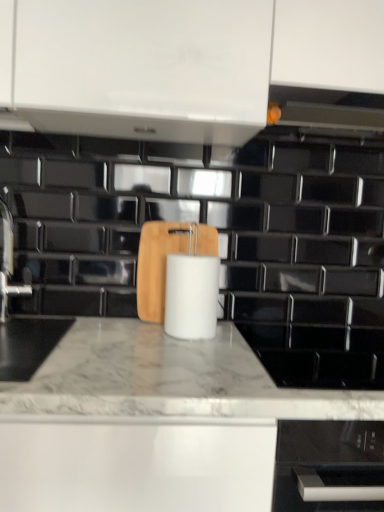
Question: From the image's perspective, is white matte paper towel at center located beneath satin nickel faucet at left?

Choices:
 (A) no
 (B) yes

Answer: (B)

Question: Is white matte paper towel at center far from satin nickel faucet at left?

Choices:
 (A) no
 (B) yes

Answer: (A)

Question: Does white matte paper towel at center lie behind satin nickel faucet at left?

Choices:
 (A) no
 (B) yes

Answer: (A)

Question: Is white matte paper towel at center surrounding satin nickel faucet at left?

Choices:
 (A) yes
 (B) no

Answer: (B)

Question: Is white matte paper towel at center at the right side of satin nickel faucet at left?

Choices:
 (A) yes
 (B) no

Answer: (A)

Question: Is white matte paper towel at center thinner than satin nickel faucet at left?

Choices:
 (A) yes
 (B) no

Answer: (B)

Question: Is wooden cutting board at center oriented towards white matte paper towel at center?

Choices:
 (A) no
 (B) yes

Answer: (B)

Question: Could white matte paper towel at center be considered to be inside wooden cutting board at center?

Choices:
 (A) no
 (B) yes

Answer: (A)

Question: Can you confirm if wooden cutting board at center is bigger than white matte paper towel at center?

Choices:
 (A) yes
 (B) no

Answer: (B)

Question: Is the position of wooden cutting board at center more distant than that of white matte paper towel at center?

Choices:
 (A) yes
 (B) no

Answer: (A)

Question: Does wooden cutting board at center appear on the right side of white matte paper towel at center?

Choices:
 (A) yes
 (B) no

Answer: (B)

Question: Is wooden cutting board at center thinner than white matte paper towel at center?

Choices:
 (A) no
 (B) yes

Answer: (B)

Question: Does wooden cutting board at center appear on the left side of white marble countertop at center?

Choices:
 (A) yes
 (B) no

Answer: (A)